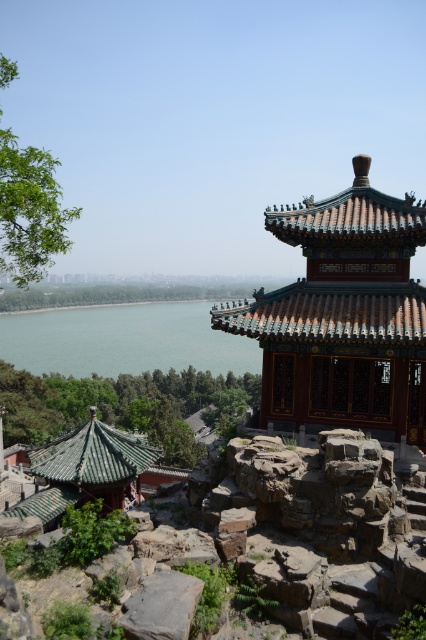
Can you confirm if shiny dark green gazebo at upper right is wider than green water at lower left?

No, shiny dark green gazebo at upper right is not wider than green water at lower left.

Which is in front, point (325, 348) or point (213, 339)?

Point (325, 348) is more forward.

What do you see at coordinates (342, 316) in the screenshot? Image resolution: width=426 pixels, height=640 pixels. I see `shiny dark green gazebo at upper right` at bounding box center [342, 316].

At what (x,y) coordinates should I click in order to perform the action: click on shiny dark green gazebo at upper right. Please return your answer as a coordinate pair (x, y). Looking at the image, I should click on (342, 316).

Can you confirm if green water at lower left is thinner than gray rough rock at center?

No.

Is point (85, 358) behind point (173, 608)?

Yes, point (85, 358) is behind point (173, 608).

Is point (183, 310) behind point (175, 593)?

Yes, it is.

Find the location of a particular element. The height and width of the screenshot is (640, 426). green water at lower left is located at coordinates (123, 340).

Locate an element on the screen. shiny dark green gazebo at upper right is located at coordinates (342, 316).

Who is lower down, shiny dark green gazebo at upper right or gray rough rock at center?

Positioned lower is gray rough rock at center.

Which is behind, point (339, 362) or point (166, 593)?

Point (339, 362)

Where is `shiny dark green gazebo at upper right`? This screenshot has height=640, width=426. shiny dark green gazebo at upper right is located at coordinates (342, 316).